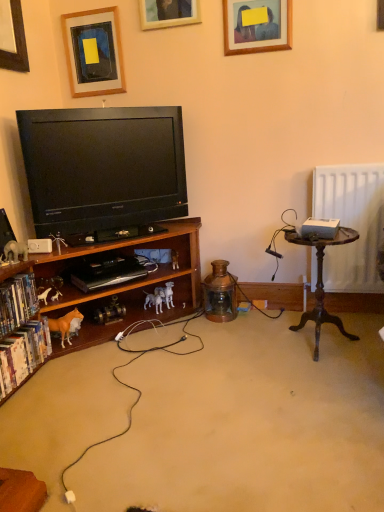
Locate an element on the screen. vacant space in woodenmaterial/texture bookcase at left (from a real-world perspective) is located at coordinates (108, 380).